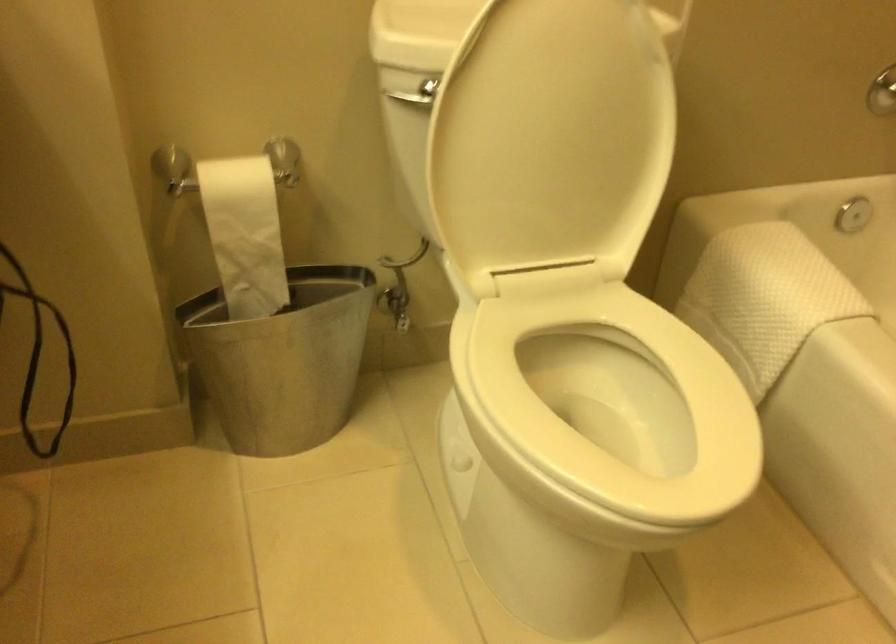
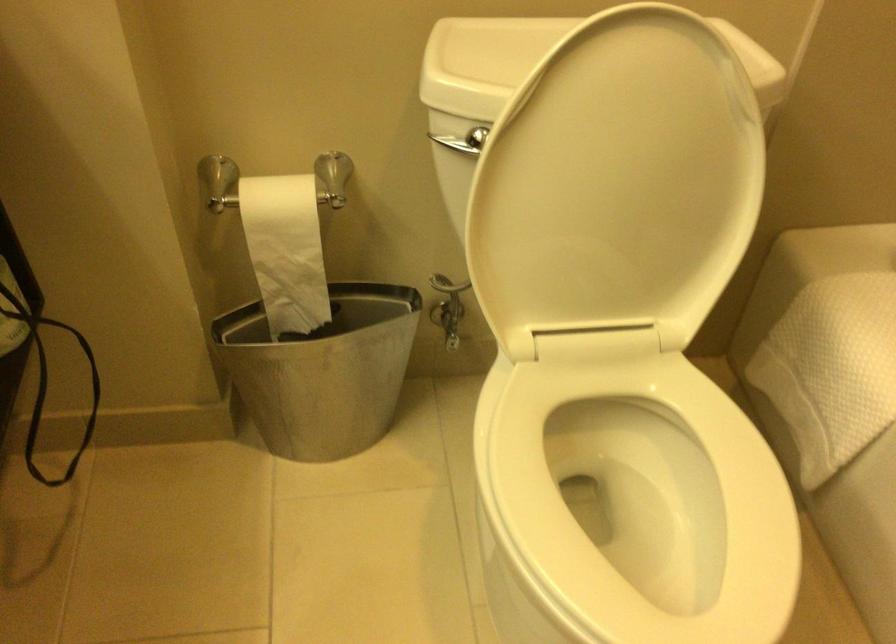
The point at (288, 348) is marked in the first image. Where is the corresponding point in the second image?

(323, 371)